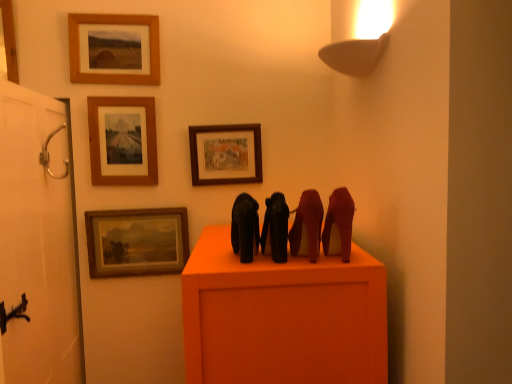
Question: Is brushed metal picture frame at upper left, the fifth picture frame in the right-to-left sequence, wider than wooden picture frame at upper center, the first picture frame positioned from the right?

Choices:
 (A) yes
 (B) no

Answer: (A)

Question: From the image's perspective, does brushed metal picture frame at upper left, the fifth picture frame in the right-to-left sequence, appear lower than wooden picture frame at upper center, the 5th picture frame viewed from the left?

Choices:
 (A) no
 (B) yes

Answer: (A)

Question: Is brushed metal picture frame at upper left, the fifth picture frame in the right-to-left sequence, in front of wooden picture frame at upper center, the 5th picture frame viewed from the left?

Choices:
 (A) no
 (B) yes

Answer: (B)

Question: Can you confirm if brushed metal picture frame at upper left, the fifth picture frame in the right-to-left sequence, is positioned to the right of wooden picture frame at upper center, the first picture frame positioned from the right?

Choices:
 (A) no
 (B) yes

Answer: (A)

Question: Is brushed metal picture frame at upper left, the fifth picture frame in the right-to-left sequence, bigger than wooden picture frame at upper center, the 5th picture frame viewed from the left?

Choices:
 (A) no
 (B) yes

Answer: (B)

Question: Is brushed metal picture frame at upper left, the fifth picture frame in the right-to-left sequence, with wooden picture frame at upper center, the 5th picture frame viewed from the left?

Choices:
 (A) yes
 (B) no

Answer: (B)

Question: Is satin red high-heels at right, the 4th animal viewed from the left, beside brushed metal picture frame at upper left, which appears as the 1th picture frame when viewed from the left?

Choices:
 (A) yes
 (B) no

Answer: (B)

Question: Considering the relative sizes of satin red high-heels at right, the 4th animal viewed from the left, and brushed metal picture frame at upper left, which appears as the 1th picture frame when viewed from the left, in the image provided, is satin red high-heels at right, the 4th animal viewed from the left, thinner than brushed metal picture frame at upper left, which appears as the 1th picture frame when viewed from the left,?

Choices:
 (A) yes
 (B) no

Answer: (B)

Question: Is brushed metal picture frame at upper left, which appears as the 1th picture frame when viewed from the left, a part of satin red high-heels at right, the 4th animal viewed from the left?

Choices:
 (A) yes
 (B) no

Answer: (B)

Question: From the image's perspective, is satin red high-heels at right, the first animal when ordered from right to left, over brushed metal picture frame at upper left, which appears as the 1th picture frame when viewed from the left?

Choices:
 (A) no
 (B) yes

Answer: (A)

Question: Is satin red high-heels at right, the first animal when ordered from right to left, not near brushed metal picture frame at upper left, which appears as the 1th picture frame when viewed from the left?

Choices:
 (A) yes
 (B) no

Answer: (A)

Question: Considering the relative positions of satin red high-heels at right, the 4th animal viewed from the left, and brushed metal picture frame at upper left, the fifth picture frame in the right-to-left sequence, in the image provided, is satin red high-heels at right, the 4th animal viewed from the left, to the left of brushed metal picture frame at upper left, the fifth picture frame in the right-to-left sequence, from the viewer's perspective?

Choices:
 (A) no
 (B) yes

Answer: (A)

Question: Considering the relative sizes of silver metallic door handle at left and wooden frame at upper center, the 3th picture frame in the right-to-left sequence, in the image provided, is silver metallic door handle at left bigger than wooden frame at upper center, the 3th picture frame in the right-to-left sequence,?

Choices:
 (A) yes
 (B) no

Answer: (B)